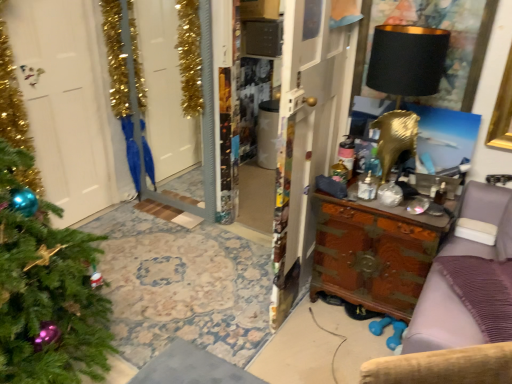
In order to click on free space in front of wooden chest at center in this screenshot , I will do `click(313, 341)`.